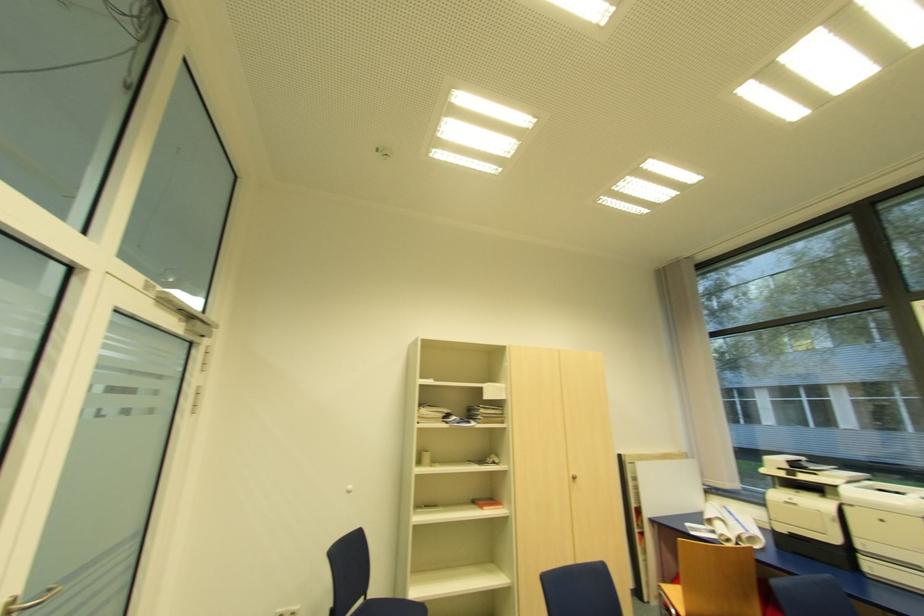
Where would you turn the small cabinet handle? Please return your answer as a coordinate pair (x, y).

(574, 476)